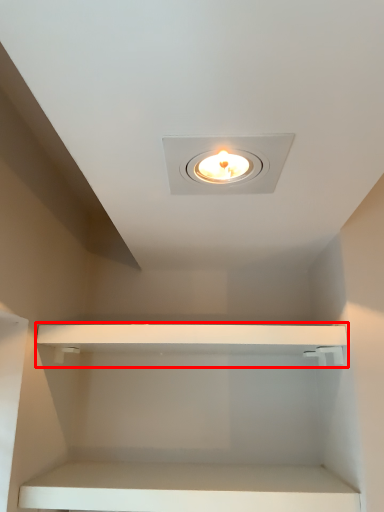
Question: From the image's perspective, considering the relative positions of cabinet (annotated by the red box) and cabinet in the image provided, where is cabinet (annotated by the red box) located with respect to the staircase?

Choices:
 (A) below
 (B) above

Answer: (B)